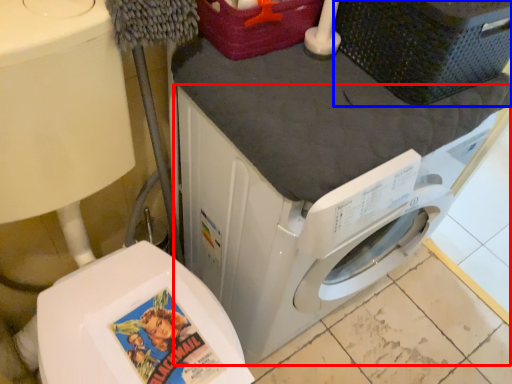
Question: Among these objects, which one is farthest to the camera, washing machine (highlighted by a red box) or basket (highlighted by a blue box)?

Choices:
 (A) washing machine
 (B) basket

Answer: (B)